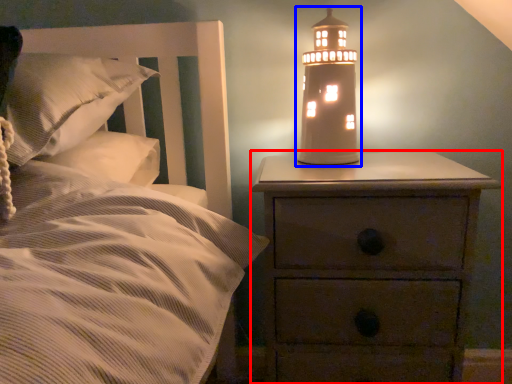
Question: Which of the following is the closest to the observer, nightstand (highlighted by a red box) or oil lamp (highlighted by a blue box)?

Choices:
 (A) nightstand
 (B) oil lamp

Answer: (A)